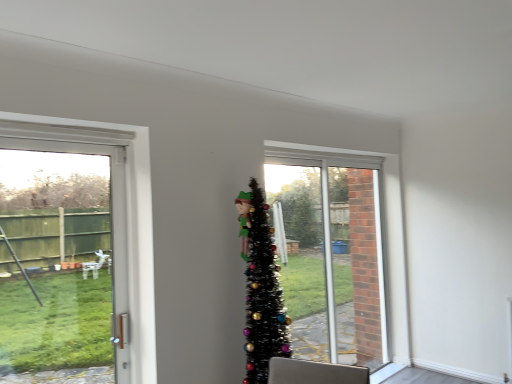
The width and height of the screenshot is (512, 384). Identify the location of white plastic door at left. (63, 260).

What is the approximate width of black tinsel christmas tree at center?

black tinsel christmas tree at center is 17.87 inches in width.

This screenshot has height=384, width=512. Find the location of `white plastic door at left`. white plastic door at left is located at coordinates (63, 260).

Is clear glass window at center not inside white plastic door at left?

Indeed, clear glass window at center is completely outside white plastic door at left.

Does point (311, 252) lie in front of point (13, 222)?

No, it is behind (13, 222).

Considering the positions of objects clear glass window at center and white plastic door at left in the image provided, who is more to the left, clear glass window at center or white plastic door at left?

Positioned to the left is white plastic door at left.

Which object is more forward, clear glass window at center or black tinsel christmas tree at center?

Positioned in front is black tinsel christmas tree at center.

Between clear glass window at center and black tinsel christmas tree at center, which one has smaller width?

clear glass window at center.

Considering the relative sizes of clear glass window at center and black tinsel christmas tree at center in the image provided, is clear glass window at center shorter than black tinsel christmas tree at center?

In fact, clear glass window at center may be taller than black tinsel christmas tree at center.

Is black tinsel christmas tree at center beside white plastic door at left?

They are not placed beside each other.

From a real-world perspective, which is physically above, black tinsel christmas tree at center or white plastic door at left?

white plastic door at left.

Considering the relative sizes of black tinsel christmas tree at center and white plastic door at left in the image provided, is black tinsel christmas tree at center thinner than white plastic door at left?

In fact, black tinsel christmas tree at center might be wider than white plastic door at left.

From the image's perspective, between black tinsel christmas tree at center and clear glass window at center, who is located below?

clear glass window at center, from the image's perspective.

Is clear glass window at center located within black tinsel christmas tree at center?

No, clear glass window at center is not surrounded by black tinsel christmas tree at center.

Is black tinsel christmas tree at center to the right of clear glass window at center from the viewer's perspective?

No, black tinsel christmas tree at center is not to the right of clear glass window at center.

Looking at this image, measure the distance between black tinsel christmas tree at center and clear glass window at center.

The distance of black tinsel christmas tree at center from clear glass window at center is 4.19 feet.

Is white plastic door at left inside or outside of black tinsel christmas tree at center?

white plastic door at left exists outside the volume of black tinsel christmas tree at center.

Which object is wider, white plastic door at left or black tinsel christmas tree at center?

With larger width is black tinsel christmas tree at center.

Is white plastic door at left not close to black tinsel christmas tree at center?

That's right, there is a large distance between white plastic door at left and black tinsel christmas tree at center.

Does point (100, 197) come farther from viewer compared to point (344, 250)?

Yes, point (100, 197) is behind point (344, 250).

From a real-world perspective, is white plastic door at left above or below clear glass window at center?

white plastic door at left is situated higher than clear glass window at center in the real world.

Are white plastic door at left and clear glass window at center far apart?

Yes, white plastic door at left and clear glass window at center are quite far apart.

From the image's perspective, between white plastic door at left and clear glass window at center, who is located below?

clear glass window at center.

This screenshot has height=384, width=512. I want to click on window lying behind the white plastic door at left, so click(x=332, y=250).

Locate an element on the screen. This screenshot has height=384, width=512. window that is under the black tinsel christmas tree at center (from a real-world perspective) is located at coordinates (332, 250).

Based on their spatial positions, is white plastic door at left or black tinsel christmas tree at center further from clear glass window at center?

white plastic door at left is further to clear glass window at center.

Based on their spatial positions, is clear glass window at center or black tinsel christmas tree at center further from white plastic door at left?

Based on the image, clear glass window at center appears to be further to white plastic door at left.

Based on their spatial positions, is black tinsel christmas tree at center or white plastic door at left closer to clear glass window at center?

Based on the image, black tinsel christmas tree at center appears to be nearer to clear glass window at center.

From the image, which object appears to be nearer to black tinsel christmas tree at center, clear glass window at center or white plastic door at left?

The object closer to black tinsel christmas tree at center is clear glass window at center.

Estimate the real-world distances between objects in this image. Which object is further from white plastic door at left, black tinsel christmas tree at center or clear glass window at center?

clear glass window at center lies further to white plastic door at left than the other object.

Looking at the image, which one is located further to black tinsel christmas tree at center, white plastic door at left or clear glass window at center?

Answer: white plastic door at left is positioned further to the anchor black tinsel christmas tree at center.

Locate an element on the screen. The height and width of the screenshot is (384, 512). christmas tree situated between white plastic door at left and clear glass window at center from left to right is located at coordinates (261, 288).